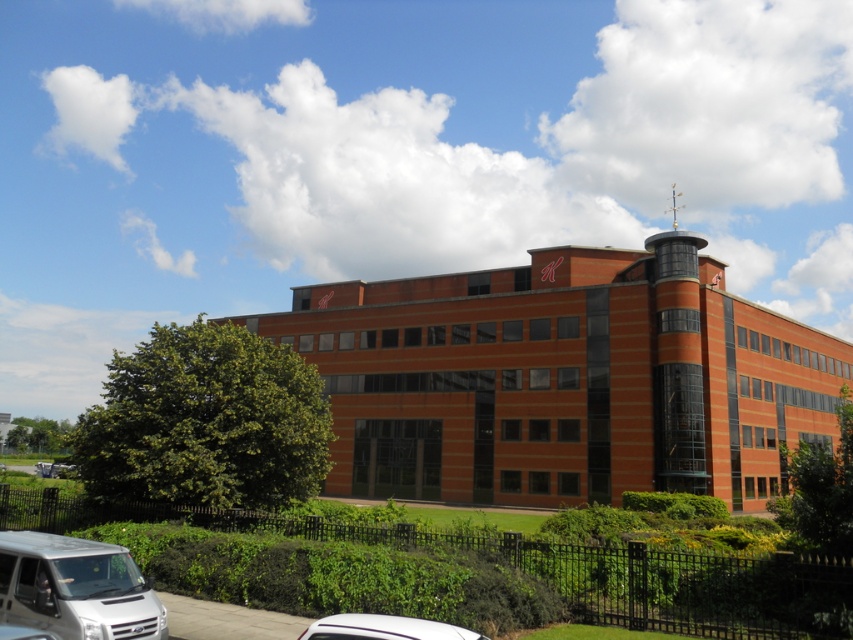
You are standing on the sidewalk next to the white vehicle and want to reach the green leafy hedge at lower left. The path to the hedge is straight but has a 1.2 meter wide obstacle in the middle. If you walk directly towards the hedge, will you be able to bypass the obstacle without going around it?

The distance between you and the green leafy hedge at lower left is 15.57 meters. Since the obstacle is only 1.2 meters wide, you can easily walk around it on either side to reach the hedge without needing to go all the way around.

You are a visitor arriving at the building and need to park your car. You see the green leafy hedge at lower left and the white glossy car at lower center. Which object is closer to the entrance of the building?

The white glossy car at lower center is closer to the entrance of the building because it is positioned to the right of the green leafy hedge at lower left, which is further away on the left side.

You are standing at the entrance of the building and want to walk to the green leafy hedge at lower left. What direction should you head from the entrance?

The green leafy hedge at lower left is located at coordinates (206,420), so you should head towards the lower left direction from the entrance.